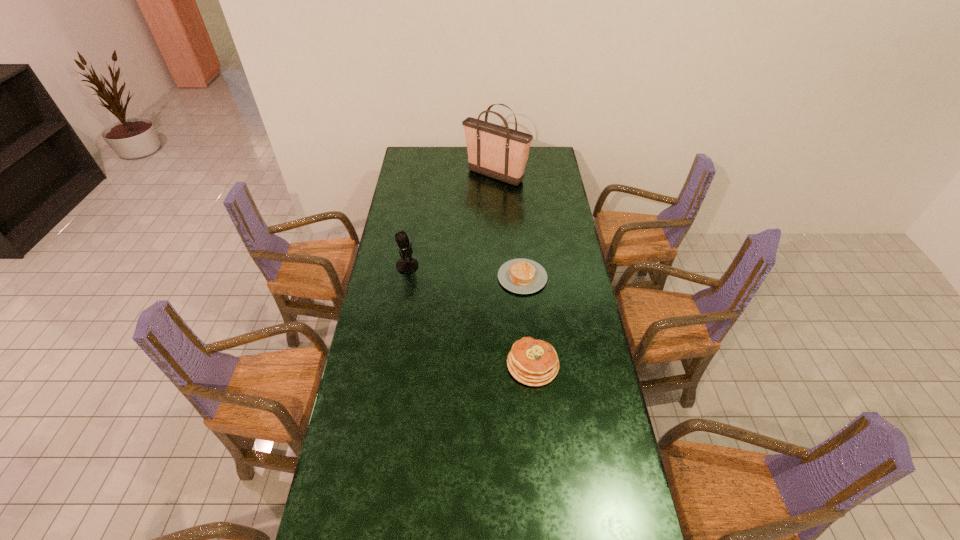
Locate an element on the screen. vacant area that lies between the third shortest object and the farther pancake is located at coordinates (465, 272).

Locate an element on the screen. free point between the tallest object and the leftmost object is located at coordinates (451, 221).

You are a GUI agent. You are given a task and a screenshot of the screen. Output one action in this format:
    pyautogui.click(x=<x>, y=<y>)
    Task: Click on the free space between the farther pancake and the nearest object
    This screenshot has width=960, height=540.
    Given the screenshot: What is the action you would take?
    pyautogui.click(x=528, y=321)

Select which object is the closest to the tallest object. Please provide its 2D coordinates. Your answer should be formatted as a tuple, i.e. [(x, y)], where the tuple contains the x and y coordinates of a point satisfying the conditions above.

[(522, 276)]

Point out which object is positioned as the second nearest to the tallest object. Please provide its 2D coordinates. Your answer should be formatted as a tuple, i.e. [(x, y)], where the tuple contains the x and y coordinates of a point satisfying the conditions above.

[(407, 264)]

I want to click on free space that satisfies the following two spatial constraints: 1. on the front side of the microphone; 2. on the right side of the farther pancake, so click(x=405, y=277).

Identify the location of vacant space that satisfies the following two spatial constraints: 1. on the front side of the leftmost object; 2. on the right side of the farther pancake. The width and height of the screenshot is (960, 540). (405, 277).

This screenshot has height=540, width=960. I want to click on free space that satisfies the following two spatial constraints: 1. on the front side of the microphone; 2. on the left side of the nearer pancake, so click(x=391, y=364).

At what (x,y) coordinates should I click in order to perform the action: click on free space that satisfies the following two spatial constraints: 1. on the front side of the leftmost object; 2. on the left side of the nearer pancake. Please return your answer as a coordinate pair (x, y). The height and width of the screenshot is (540, 960). Looking at the image, I should click on (391, 364).